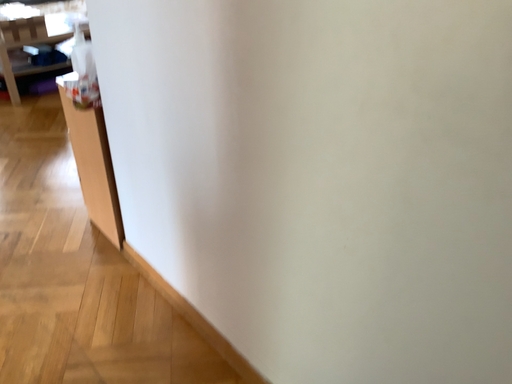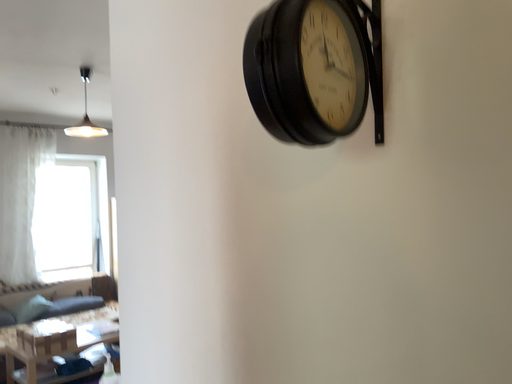
Question: Which way did the camera rotate in the video?

Choices:
 (A) rotated downward
 (B) rotated upward

Answer: (B)